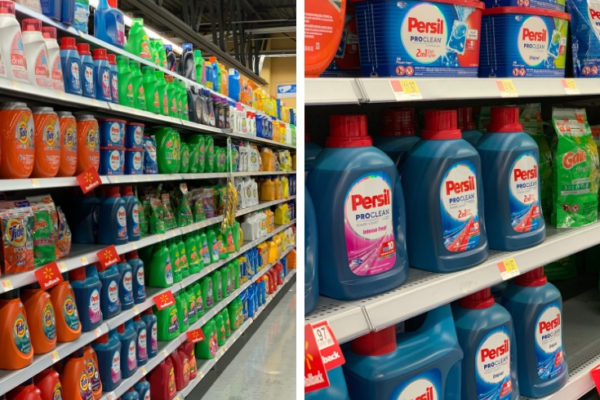
Where is `metal ceiling rafters`? metal ceiling rafters is located at coordinates (237, 12).